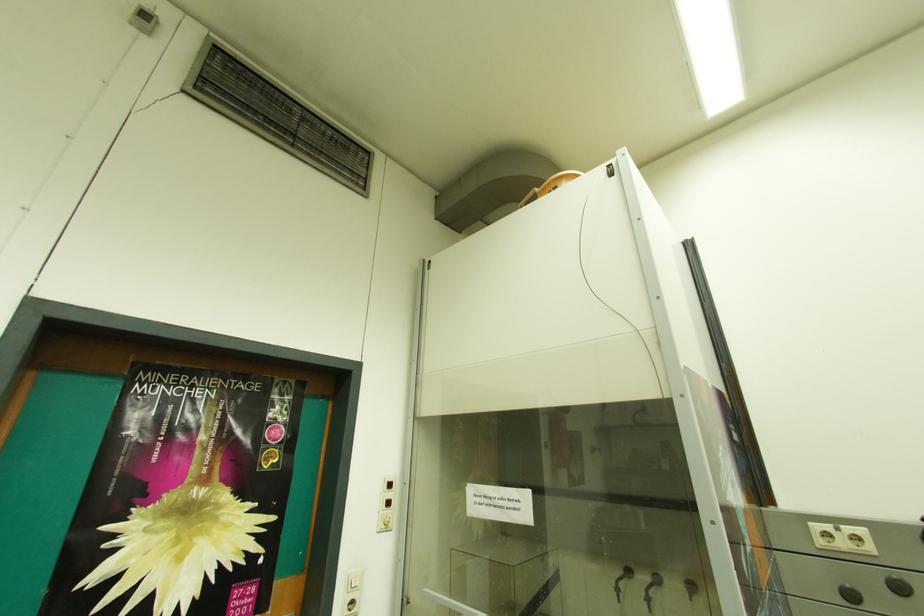
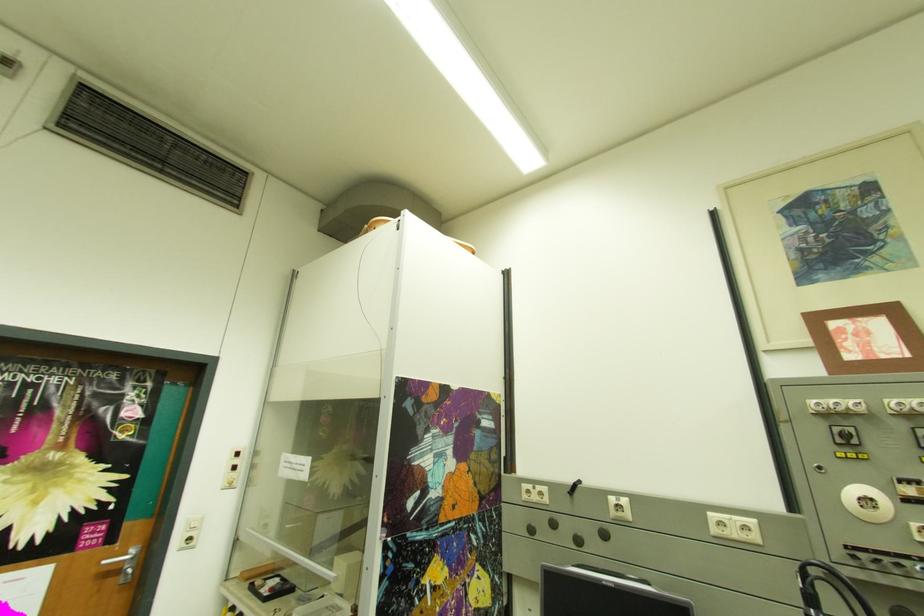
Question: Based on the continuous images, in which direction is the camera rotating? Reply with the corresponding letter.

Choices:
 (A) Left
 (B) Right
 (C) Up
 (D) Down

Answer: (B)